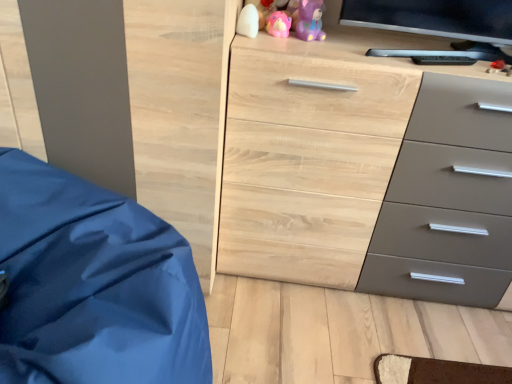
Question: From the image's perspective, is light wood/texture chest of drawers at center located above or below purple matte bear at upper center, acting as the first toy starting from the right?

Choices:
 (A) above
 (B) below

Answer: (B)

Question: Looking at their shapes, would you say light wood/texture chest of drawers at center is wider or thinner than purple matte bear at upper center, acting as the first toy starting from the right?

Choices:
 (A) thin
 (B) wide

Answer: (B)

Question: Estimate the real-world distances between objects in this image. Which object is farther from the pink rubber duck at upper center, the second toy from the left?

Choices:
 (A) light wood/texture chest of drawers at center
 (B) white matte pillow at upper center, the 3th toy in the right-to-left sequence
 (C) purple matte bear at upper center, the third toy when ordered from left to right
 (D) blue fabric at left

Answer: (D)

Question: Considering the real-world distances, which object is farthest from the blue fabric at left?

Choices:
 (A) pink rubber duck at upper center, which is counted as the 2th toy, starting from the right
 (B) light wood/texture chest of drawers at center
 (C) white matte pillow at upper center, which appears as the 1th toy when viewed from the left
 (D) purple matte bear at upper center, acting as the first toy starting from the right

Answer: (D)